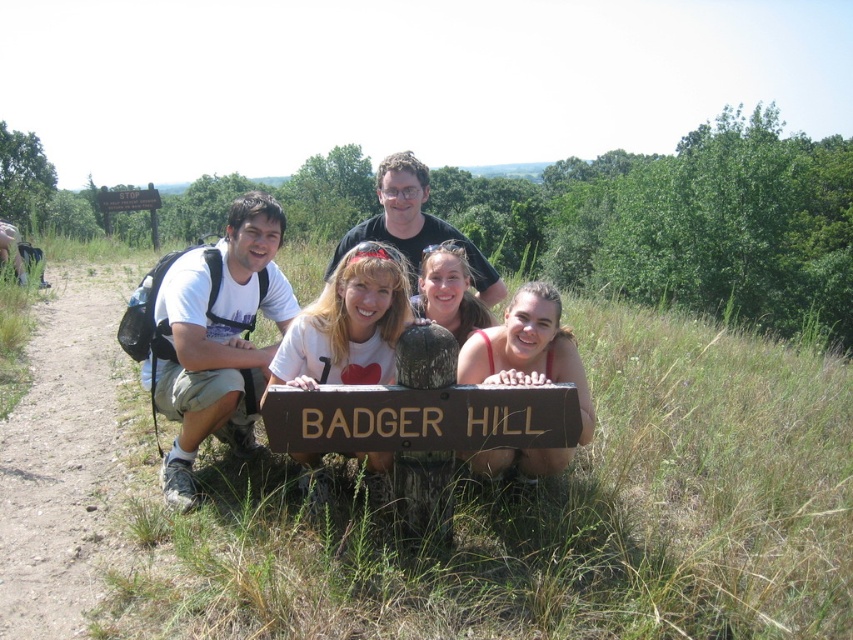
Does white matte shirt at center have a greater height compared to smooth tan skin at center?

Answer: No, white matte shirt at center is not taller than smooth tan skin at center.

Is point (364, 289) positioned in front of point (552, 310)?

That is True.

This screenshot has height=640, width=853. What do you see at coordinates (347, 323) in the screenshot?
I see `white matte shirt at center` at bounding box center [347, 323].

Image resolution: width=853 pixels, height=640 pixels. What are the coordinates of `white matte shirt at center` in the screenshot? It's located at (347, 323).

Looking at this image, how distant is white matte shirt at center from matte white shirt at center?

white matte shirt at center is 3.46 feet away from matte white shirt at center.

Between point (335, 308) and point (482, 275), which one is positioned in front?

Positioned in front is point (335, 308).

Identify the location of white matte shirt at center. (347, 323).

The image size is (853, 640). What are the coordinates of `matte white shirt at center` in the screenshot? It's located at (415, 225).

Between matte white shirt at center and brown wooden sign at upper center, which one is positioned lower?

matte white shirt at center is below.

Locate an element on the screen. Image resolution: width=853 pixels, height=640 pixels. matte white shirt at center is located at coordinates (415, 225).

Identify the location of matte white shirt at center. pos(415,225).